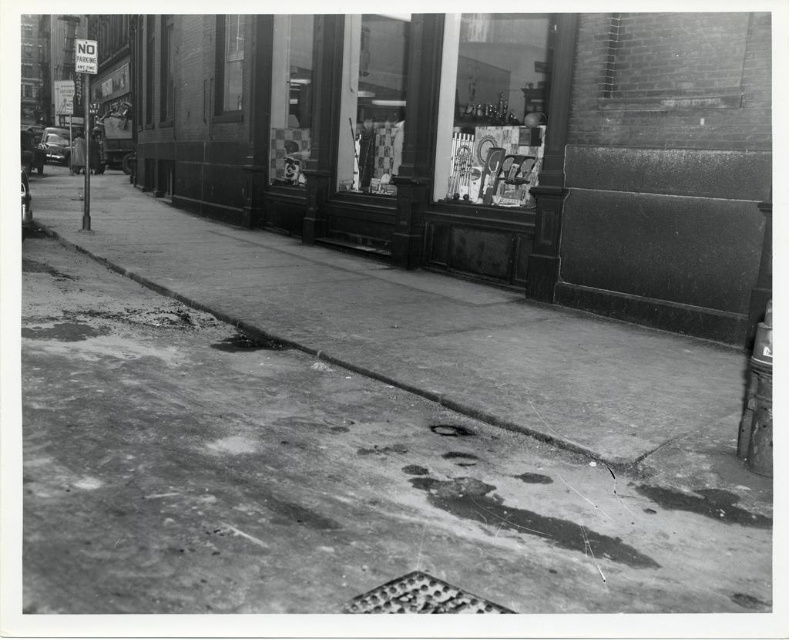
Question: Which of these objects is positioned farthest from the smooth concrete curb at lower center?

Choices:
 (A) glass display case at upper center
 (B) concrete sidewalk at center
 (C) checkerboard glass chess set at center

Answer: (C)

Question: Estimate the real-world distances between objects in this image. Which object is closer to the concrete sidewalk at center?

Choices:
 (A) metallic gray manhole cover at center
 (B) checkerboard glass chess set at center

Answer: (A)

Question: Can you confirm if metallic grid manhole cover at lower center is positioned to the right of metallic gray manhole cover at center?

Choices:
 (A) yes
 (B) no

Answer: (B)

Question: Based on their relative distances, which object is nearer to the glass display case at upper center?

Choices:
 (A) metallic grid manhole cover at lower center
 (B) concrete sidewalk at center

Answer: (B)

Question: Does glass display case at upper center lie in front of metallic gray manhole cover at center?

Choices:
 (A) yes
 (B) no

Answer: (B)

Question: Can you confirm if concrete sidewalk at center is wider than smooth concrete curb at lower center?

Choices:
 (A) yes
 (B) no

Answer: (A)